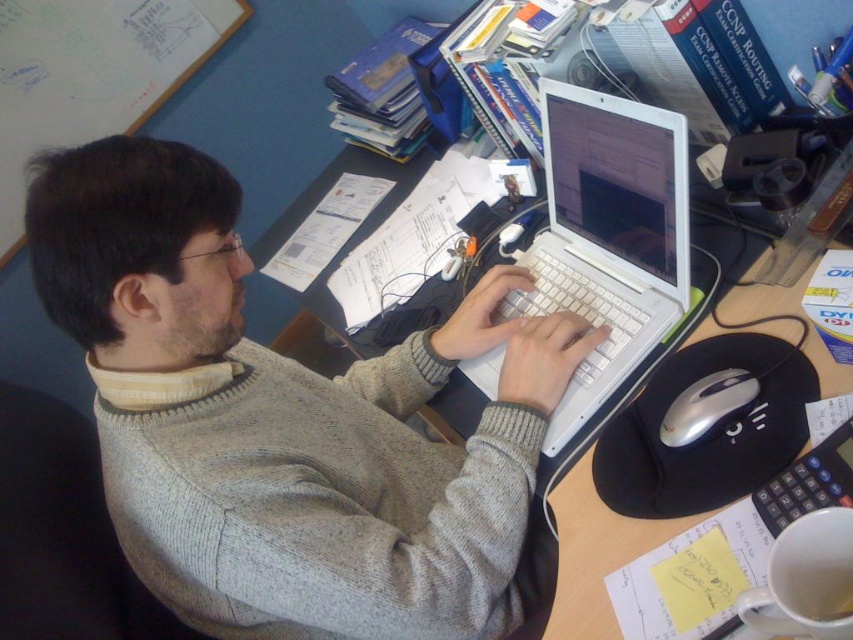
Is gray sweater at center to the right of wooden desk at center from the viewer's perspective?

No, gray sweater at center is not to the right of wooden desk at center.

Who is positioned more to the left, gray sweater at center or wooden desk at center?

Positioned to the left is gray sweater at center.

Locate an element on the screen. This screenshot has width=853, height=640. gray sweater at center is located at coordinates (282, 420).

Who is taller, white glossy laptop at center or silver metallic mouse at lower right?

white glossy laptop at center

Which is more to the left, white glossy laptop at center or silver metallic mouse at lower right?

Positioned to the left is white glossy laptop at center.

Who is more distant from viewer, (614, 248) or (708, 432)?

The point (614, 248) is behind.

Identify the location of white glossy laptop at center. (619, 179).

Is point (782, 324) more distant than point (722, 426)?

Yes, point (782, 324) is behind point (722, 426).

Can you confirm if wooden desk at center is thinner than silver metallic mouse at lower right?

No, wooden desk at center is not thinner than silver metallic mouse at lower right.

The image size is (853, 640). What are the coordinates of `wooden desk at center` in the screenshot? It's located at (653, 372).

Image resolution: width=853 pixels, height=640 pixels. I want to click on wooden desk at center, so click(x=653, y=372).